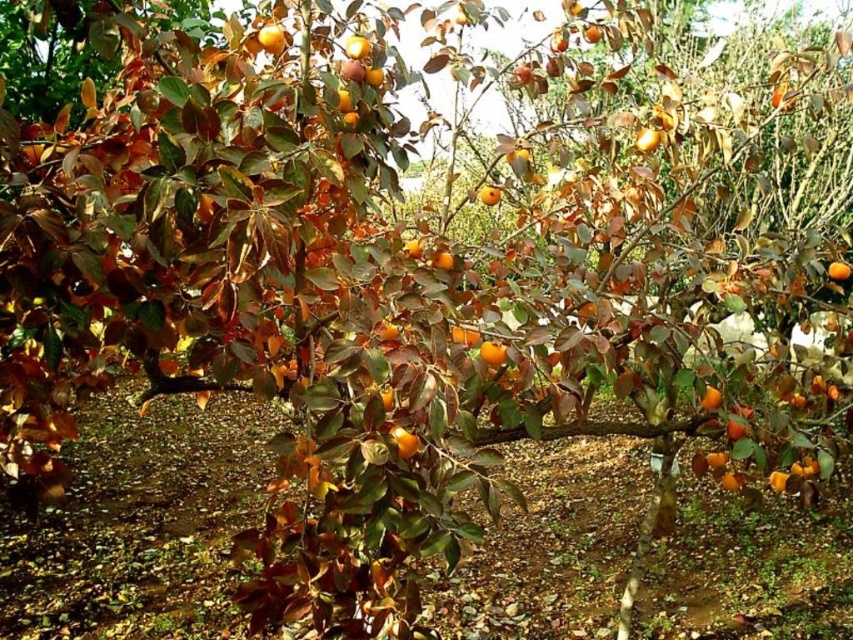
Question: Observing the image, what is the correct spatial positioning of shiny orange fruit at upper center in reference to orange matte/orange at upper center?

Choices:
 (A) right
 (B) left

Answer: (B)

Question: Among these points, which one is nearest to the camera?

Choices:
 (A) (495, 204)
 (B) (718, 404)
 (C) (641, 131)

Answer: (B)

Question: Which of these objects is positioned farthest from the orange matte/orange at center?

Choices:
 (A) shiny orange fruit at upper center
 (B) orange matte/orange at upper center
 (C) orange matte fruit at center
 (D) orange matte/orange at lower right

Answer: (A)

Question: Is orange matte/orange at upper center closer to camera compared to orange matte/orange at center?

Choices:
 (A) yes
 (B) no

Answer: (B)

Question: Does orange matte/orange at center appear on the left side of orange matte fruit at center?

Choices:
 (A) yes
 (B) no

Answer: (B)

Question: Which of the following is the closest to the observer?

Choices:
 (A) orange matte/orange at center
 (B) orange matte/orange at lower right

Answer: (A)